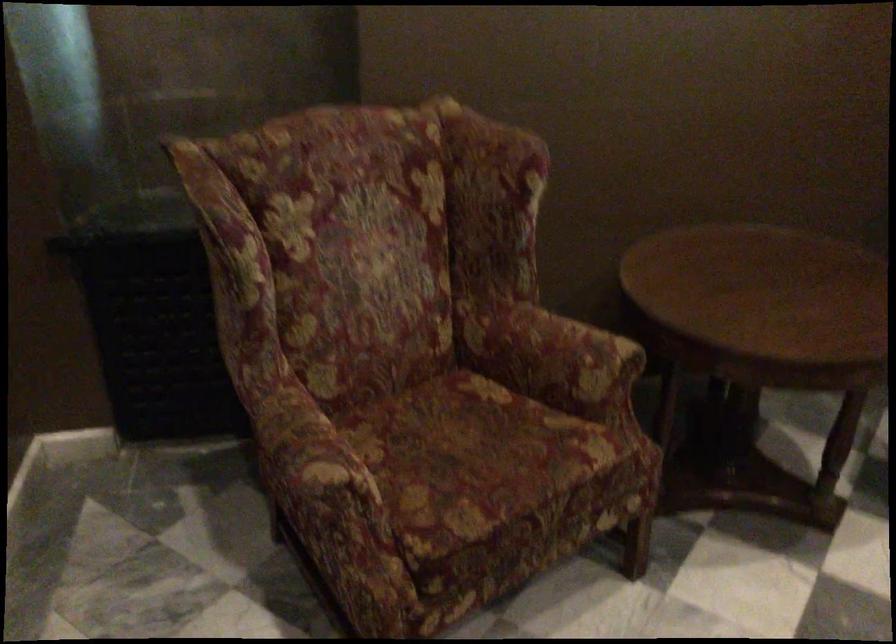
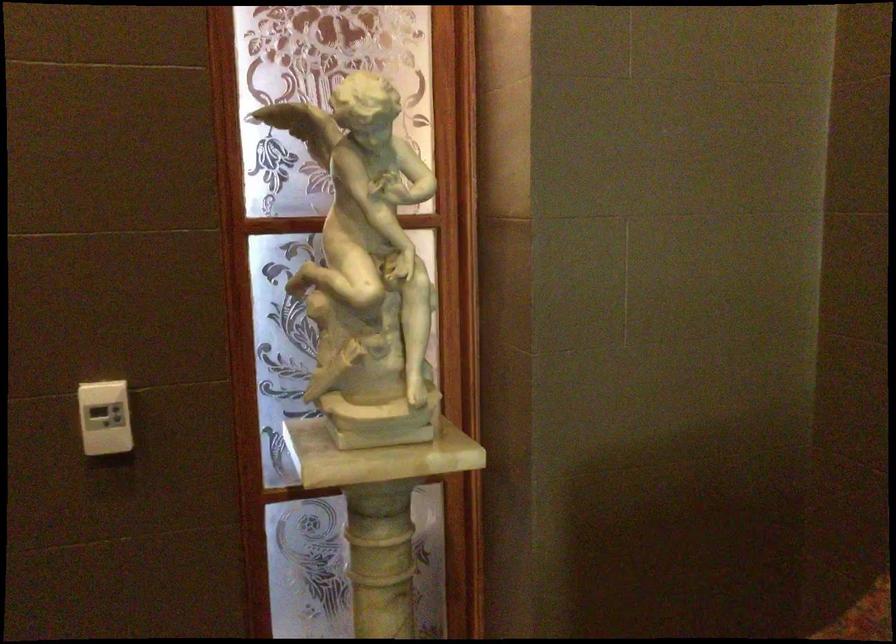
Question: How did the camera likely rotate?

Choices:
 (A) Left
 (B) Right
 (C) Up
 (D) Down

Answer: (A)